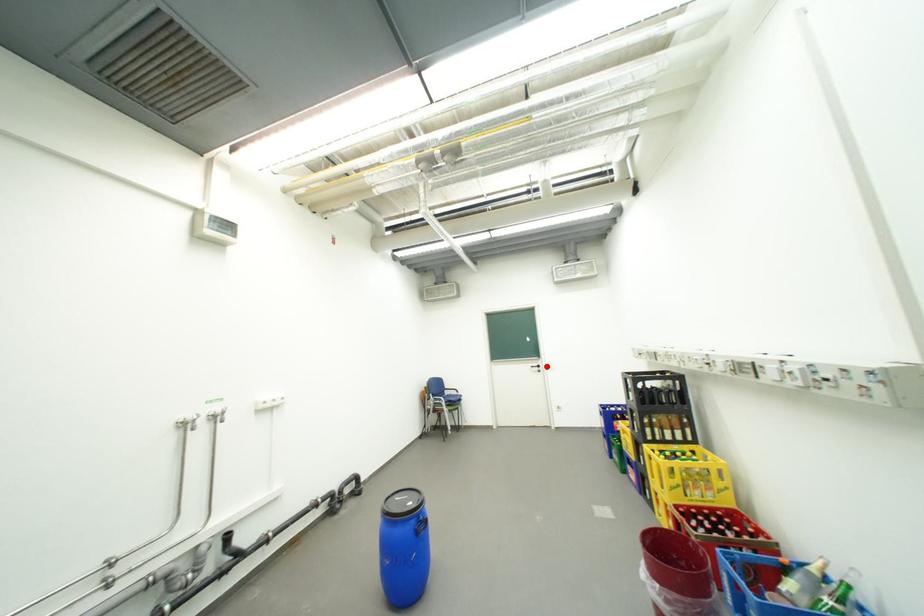
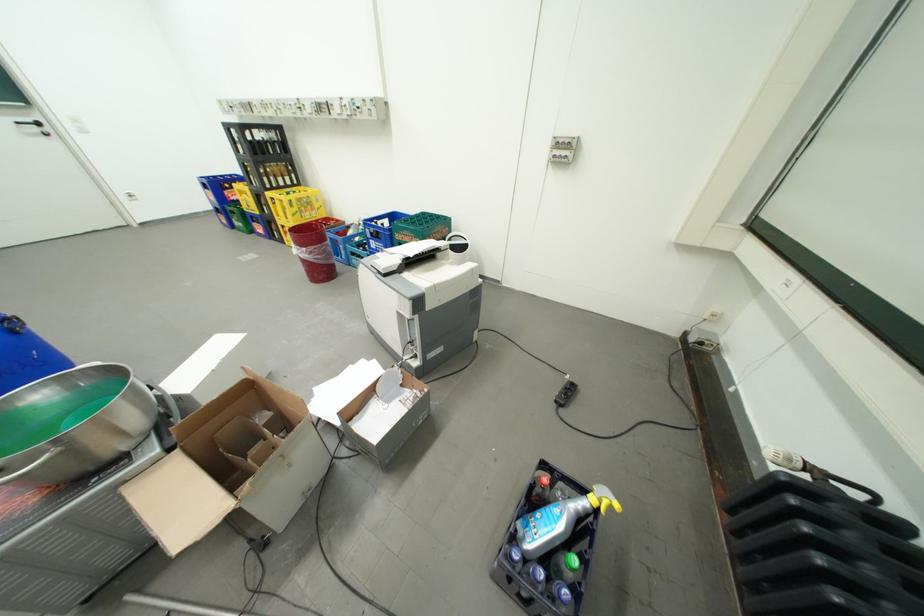
In the second image, find the point that corresponds to the highlighted location in the first image.

(41, 122)